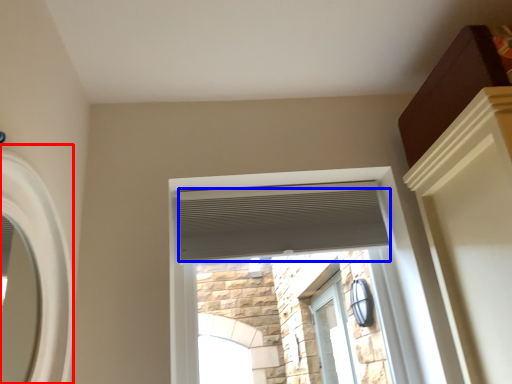
Question: Which of the following is the farthest to the observer, window (highlighted by a red box) or blind (highlighted by a blue box)?

Choices:
 (A) window
 (B) blind

Answer: (B)